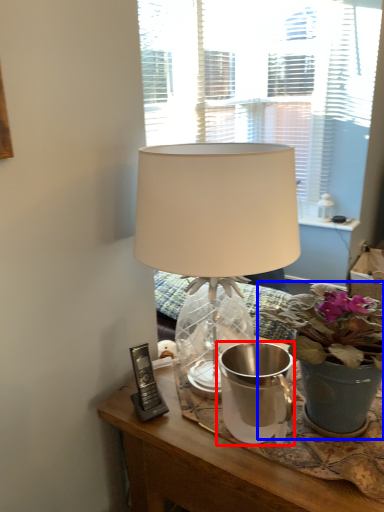
Question: Among these objects, which one is farthest to the camera, watering can (highlighted by a red box) or houseplant (highlighted by a blue box)?

Choices:
 (A) watering can
 (B) houseplant

Answer: (A)